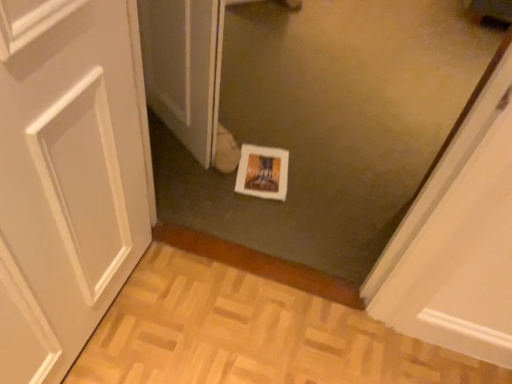
At what (x,y) coordinates should I click in order to perform the action: click on free space to the left of white glossy print at center. Please return your answer as a coordinate pair (x, y). Looking at the image, I should click on (202, 176).